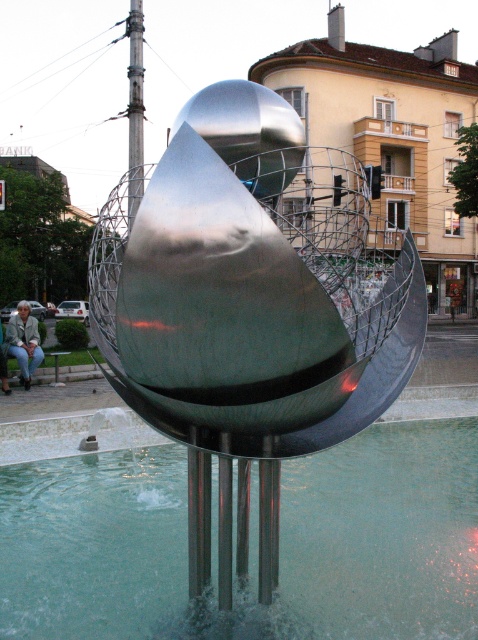
Question: Which point appears farthest from the camera in this image?

Choices:
 (A) (21, 314)
 (B) (79, 474)
 (C) (133, 26)

Answer: (C)

Question: Which point is farther from the camera taking this photo?

Choices:
 (A) (139, 83)
 (B) (22, 312)

Answer: (A)

Question: Can you confirm if clear water at fountain center is wider than silver metallic pole at upper left?

Choices:
 (A) yes
 (B) no

Answer: (B)

Question: Can you confirm if polished metal sculpture at center is thinner than silver metallic pole at upper left?

Choices:
 (A) no
 (B) yes

Answer: (A)

Question: Can you confirm if polished metal sculpture at center is smaller than silver metallic pole at upper left?

Choices:
 (A) yes
 (B) no

Answer: (B)

Question: Which is farther from the silver metallic pole at upper left?

Choices:
 (A) clear water at fountain center
 (B) polished metal sculpture at center
 (C) denim jacket at lower left

Answer: (B)